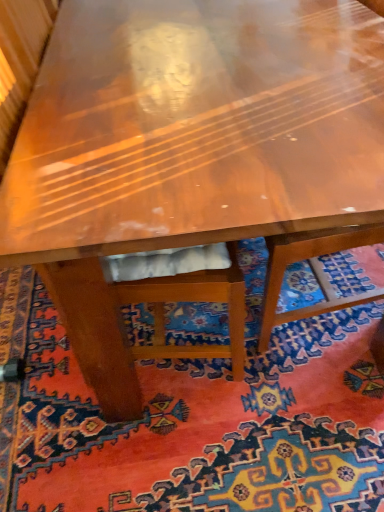
Find the location of a particular element. free spot above carpet with intricate patterns at center (from a real-world perspective) is located at coordinates (215, 402).